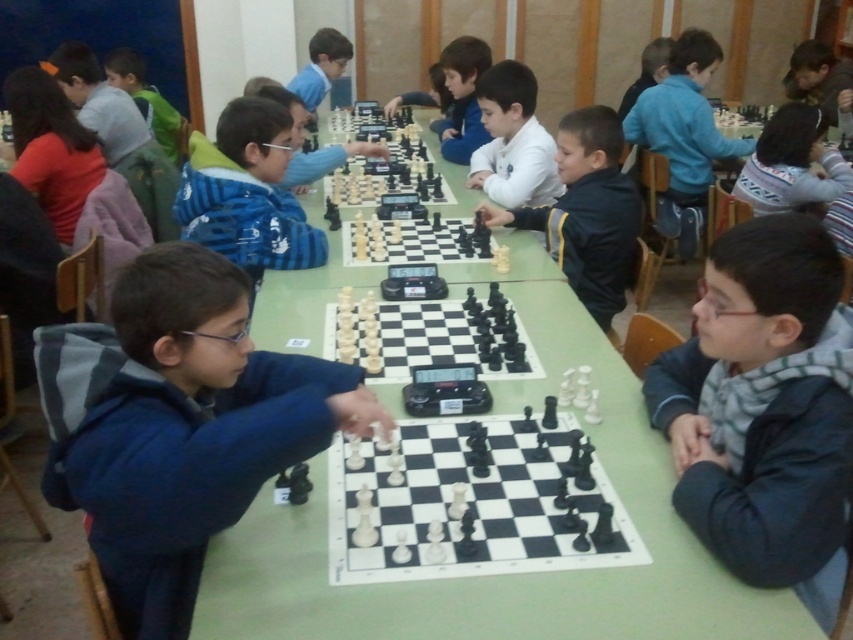
Question: Does blue fabric jacket at center come behind black plastic chess set at center?

Choices:
 (A) no
 (B) yes

Answer: (A)

Question: Considering the real-world distances, which object is closest to the white matte chess piece at center?

Choices:
 (A) dark blue jacket at center
 (B) matte blue sweater at center
 (C) white shirt at center
 (D) blue fabric jacket at center

Answer: (C)

Question: Which point is closer to the camera?

Choices:
 (A) (312, 80)
 (B) (688, 90)
 (C) (157, 580)
 (D) (764, 406)

Answer: (C)

Question: Can you confirm if polished plastic chessboard at center is positioned above matte black chess piece at upper center?

Choices:
 (A) no
 (B) yes

Answer: (A)

Question: Which point is closer to the camera taking this photo?

Choices:
 (A) [686, 358]
 (B) [408, 499]

Answer: (B)

Question: Is black plastic chess set at center further to the viewer compared to blue fleece jacket at upper right?

Choices:
 (A) no
 (B) yes

Answer: (A)